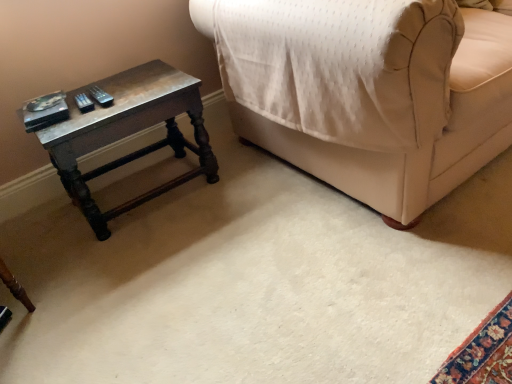
Identify the location of vacant space in front of wooden table at left. Image resolution: width=512 pixels, height=384 pixels. (129, 282).